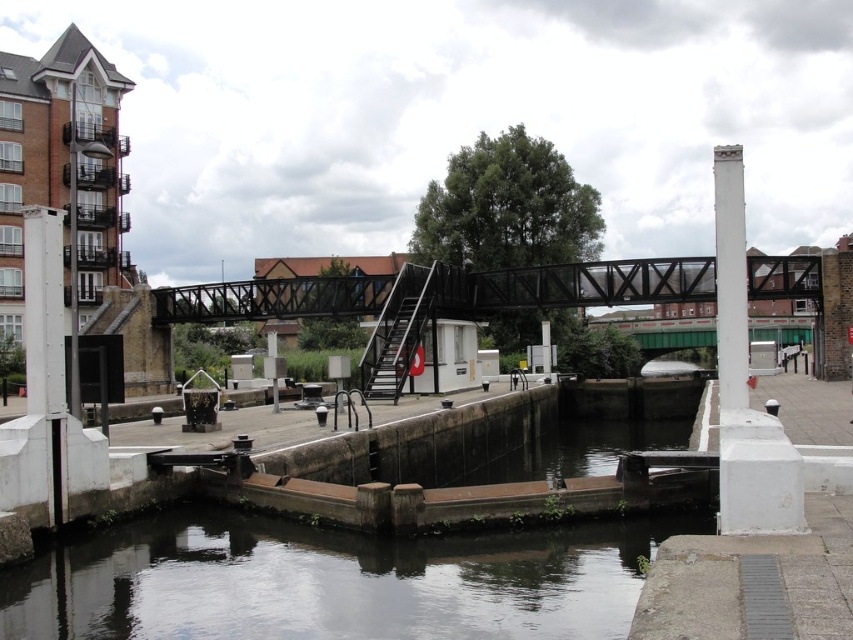
Question: Does black metal bridge at center have a smaller size compared to white concrete pillar at upper right?

Choices:
 (A) no
 (B) yes

Answer: (A)

Question: Does dark gray concrete river at lower center have a smaller size compared to black metal bridge at center?

Choices:
 (A) yes
 (B) no

Answer: (A)

Question: Which point appears farthest from the camera in this image?

Choices:
 (A) (650, 518)
 (B) (453, 291)

Answer: (B)

Question: Observing the image, what is the correct spatial positioning of black metal bridge at center in reference to white concrete pillar at upper right?

Choices:
 (A) left
 (B) right

Answer: (A)

Question: Which point is farther from the camera taking this photo?

Choices:
 (A) (579, 604)
 (B) (582, 305)

Answer: (B)

Question: Among these points, which one is farthest from the camera?

Choices:
 (A) (734, 378)
 (B) (350, 612)

Answer: (A)